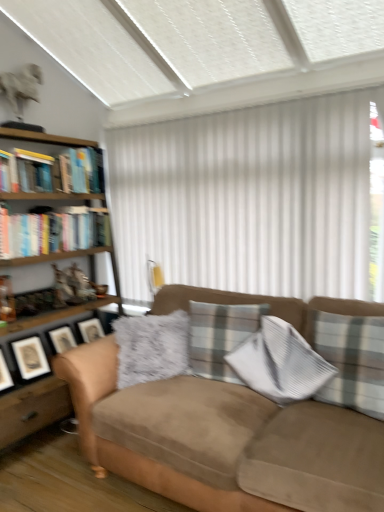
Question: Considering the relative sizes of woodenmaterial/texturebookcase at left and hardcover book at left, marked as the 2th book in a bottom-to-top arrangement, in the image provided, is woodenmaterial/texturebookcase at left smaller than hardcover book at left, marked as the 2th book in a bottom-to-top arrangement,?

Choices:
 (A) yes
 (B) no

Answer: (B)

Question: Is woodenmaterial/texturebookcase at left taller than hardcover book at left, marked as the 2th book in a bottom-to-top arrangement?

Choices:
 (A) yes
 (B) no

Answer: (A)

Question: From the image's perspective, is woodenmaterial/texturebookcase at left located beneath hardcover book at left, marked as the 2th book in a bottom-to-top arrangement?

Choices:
 (A) yes
 (B) no

Answer: (A)

Question: Can you confirm if woodenmaterial/texturebookcase at left is thinner than hardcover book at left, marked as the 2th book in a bottom-to-top arrangement?

Choices:
 (A) no
 (B) yes

Answer: (A)

Question: Is woodenmaterial/texturebookcase at left oriented towards hardcover book at left, marked as the 2th book in a bottom-to-top arrangement?

Choices:
 (A) yes
 (B) no

Answer: (A)

Question: Is matte black picture frame at left to the left or to the right of hardcover book at upper left, the fourth book in the bottom-to-top sequence, in the image?

Choices:
 (A) right
 (B) left

Answer: (B)

Question: Is matte black picture frame at left bigger or smaller than hardcover book at upper left, the fourth book in the bottom-to-top sequence?

Choices:
 (A) big
 (B) small

Answer: (A)

Question: Considering the positions of point (31, 343) and point (71, 184), is point (31, 343) closer or farther from the camera than point (71, 184)?

Choices:
 (A) closer
 (B) farther

Answer: (A)

Question: Would you say matte black picture frame at left is inside or outside hardcover book at upper left, which is the first book in top-to-bottom order?

Choices:
 (A) inside
 (B) outside

Answer: (B)

Question: From a real-world perspective, is hardcover books at left, which ranks as the fourth book in top-to-bottom order, physically located above or below hardcover book at left, marked as the 2th book in a bottom-to-top arrangement?

Choices:
 (A) below
 (B) above

Answer: (A)

Question: Considering the positions of point (89, 214) and point (3, 164), is point (89, 214) closer or farther from the camera than point (3, 164)?

Choices:
 (A) farther
 (B) closer

Answer: (A)

Question: Is hardcover books at left, which ranks as the first book in bottom-to-top order, wider or thinner than hardcover book at left, arranged as the third book when viewed from the top?

Choices:
 (A) thin
 (B) wide

Answer: (B)

Question: Is hardcover books at left, which ranks as the first book in bottom-to-top order, bigger or smaller than hardcover book at left, marked as the 2th book in a bottom-to-top arrangement?

Choices:
 (A) small
 (B) big

Answer: (B)

Question: Considering their positions, is matte black picture frame at left located in front of or behind white vertical blinds at center?

Choices:
 (A) front
 (B) behind

Answer: (B)

Question: Is matte black picture frame at left situated inside white vertical blinds at center or outside?

Choices:
 (A) inside
 (B) outside

Answer: (B)